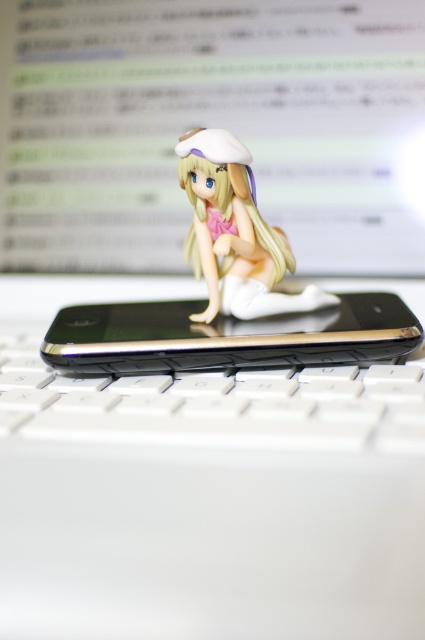
This screenshot has height=640, width=425. Describe the element at coordinates (226, 337) in the screenshot. I see `black glossy smartphone at center` at that location.

Can you confirm if black glossy smartphone at center is positioned to the left of satin white figurine at center?

Incorrect, black glossy smartphone at center is not on the left side of satin white figurine at center.

Locate an element on the screen. The height and width of the screenshot is (640, 425). black glossy smartphone at center is located at coordinates (226, 337).

Does white plastic keyboard at center appear on the left side of satin white figurine at center?

Correct, you'll find white plastic keyboard at center to the left of satin white figurine at center.

Does point (221, 387) come in front of point (221, 260)?

Yes, point (221, 387) is in front of point (221, 260).

Where is `white plastic keyboard at center`? white plastic keyboard at center is located at coordinates (215, 404).

Between white plastic keyboard at center and black glossy smartphone at center, which one has more height?

With more height is black glossy smartphone at center.

Who is higher up, white plastic keyboard at center or black glossy smartphone at center?

black glossy smartphone at center is above.

What do you see at coordinates (215, 404) in the screenshot? I see `white plastic keyboard at center` at bounding box center [215, 404].

Where is `white plastic keyboard at center`? The width and height of the screenshot is (425, 640). white plastic keyboard at center is located at coordinates (215, 404).